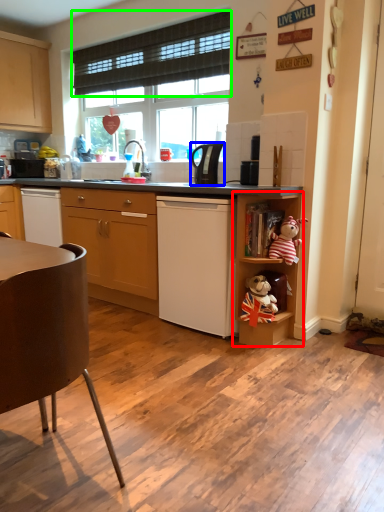
Question: Which object is the closest to the shelf (highlighted by a red box)? Choose among these: kitchen appliance (highlighted by a blue box) or curtain (highlighted by a green box).

Choices:
 (A) kitchen appliance
 (B) curtain

Answer: (A)